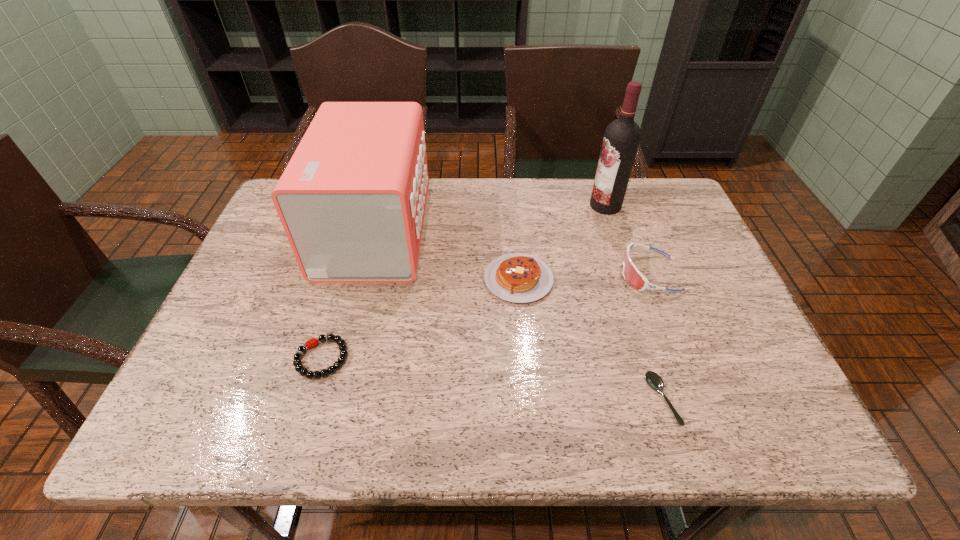
Identify the location of wine bottle. The height and width of the screenshot is (540, 960). (622, 136).

Image resolution: width=960 pixels, height=540 pixels. Find the location of `box`. box is located at coordinates (352, 199).

Identify the location of goggles. (632, 275).

Locate an element on the screen. the third shortest object is located at coordinates [x=516, y=277].

Identify the location of pancake. (516, 277).

I want to click on bracelet, so click(x=309, y=344).

Find the location of `the shortest object`. the shortest object is located at coordinates (653, 379).

This screenshot has height=540, width=960. What are the coordinates of `vacant area situated 0.320m on the label of the tallest object` in the screenshot? It's located at (482, 206).

Find the location of a particular element. free space located 0.120m on the label of the tallest object is located at coordinates (549, 206).

This screenshot has height=540, width=960. I want to click on free location located 0.330m on the label of the tallest object, so click(478, 206).